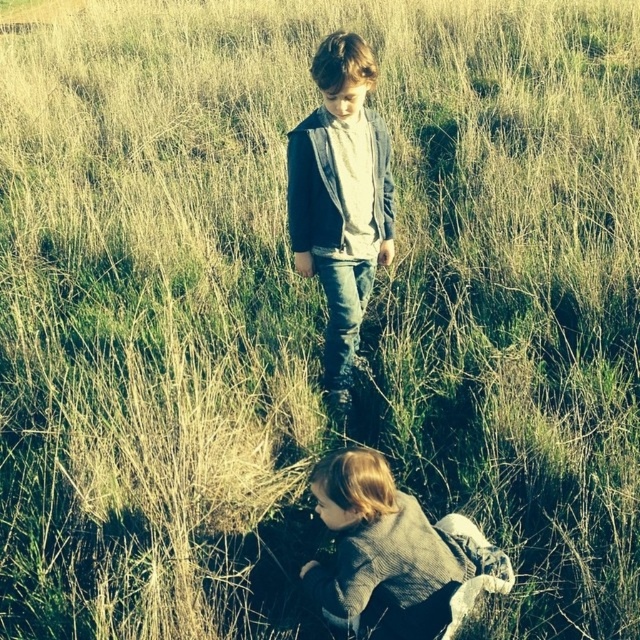
Can you confirm if denim jeans at center is taller than gray wool sweater at lower center?

Correct, denim jeans at center is much taller as gray wool sweater at lower center.

Does point (339, 275) lie in front of point (397, 566)?

No, (339, 275) is behind (397, 566).

This screenshot has width=640, height=640. I want to click on denim jeans at center, so point(340,198).